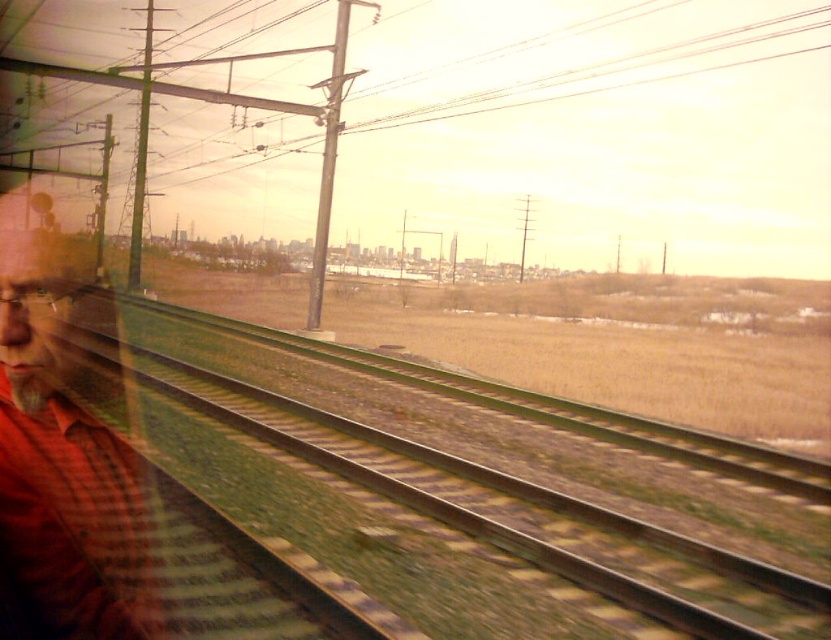
You are inside the train and looking out the window. There is a green metallic track at center. Where is the green metallic track at center located in relation to the point at coordinates (485, 500)?

The green metallic track at center is represented by the point at coordinates (485, 500).

You are a passenger sitting in the train and looking out the window. You notice the green metallic track at center and the red plaid shirt at left. Which object is closer to the window?

The red plaid shirt at left is closer to the window because the green metallic track at center is located below it, meaning the shirt is in front of the track in the viewing perspective.

In the scene shown: You are an engineer checking the train tracks. You need to locate the green metallic track at center. Where exactly is it located in the image?

The green metallic track at center is located at point 0.783 on the x axis and 0.586 on the y axis.